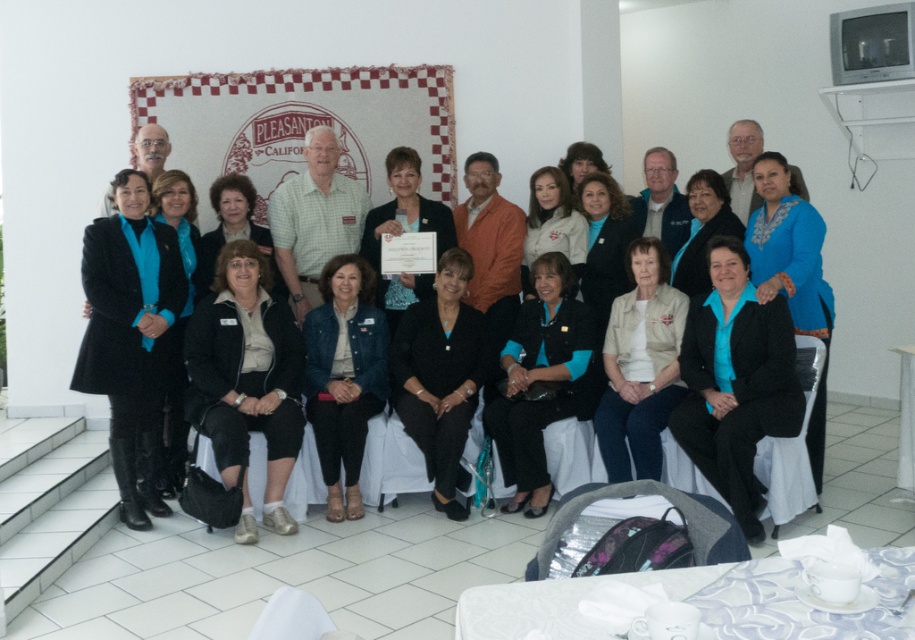
You are a photographer at the event and need to capture a photo of both the white porcelain cup at lower right and the beige fabric jacket at center. Given that your camera has a maximum focus range of 8 feet, will you be able to include both objects in the same frame without moving closer?

The white porcelain cup at lower right is 9.07 feet away from the beige fabric jacket at center. Since the distance between them exceeds the camera maximum focus range of 8 feet, you cannot include both in the same frame without moving closer.

You are organizing a photo shoot and need to arrange two jackets on a display rack. The teal fabric jacket at center and beige fabric jacket at center must be placed side by side. Given their sizes, which jacket should be placed on the left to ensure they fit within the 1.5 meter wide rack?

The beige fabric jacket at center should be placed on the left since it is narrower than the teal fabric jacket at center, allowing both to fit within the 1.5 meter wide rack.

You are standing at the front of the room where the event is taking place. There is a point at coordinates point (537, 461) that you need to reach. If you can walk 3 meters forward, will you be able to reach that point?

The distance of point (537, 461) from viewer is 5.00 meters. Since you can only walk 3 meters forward, you will not be able to reach the point as it is further away than your walking distance.